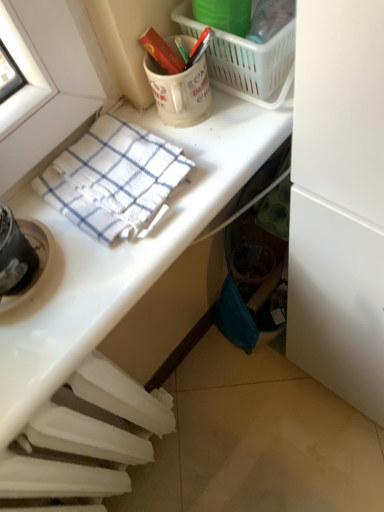
Question: Can you confirm if white checkered towel at upper left is shorter than white glossy towel at upper left?

Choices:
 (A) no
 (B) yes

Answer: (B)

Question: Is there a large distance between white checkered towel at upper left and white glossy towel at upper left?

Choices:
 (A) no
 (B) yes

Answer: (A)

Question: Is white glossy towel at upper left at the back of white checkered towel at upper left?

Choices:
 (A) yes
 (B) no

Answer: (B)

Question: Is white checkered towel at upper left placed right next to white glossy towel at upper left?

Choices:
 (A) no
 (B) yes

Answer: (A)

Question: Is white checkered towel at upper left positioned behind white glossy towel at upper left?

Choices:
 (A) yes
 (B) no

Answer: (A)

Question: Is white checkered towel at upper left facing towards white glossy towel at upper left?

Choices:
 (A) no
 (B) yes

Answer: (A)

Question: Is white glossy towel at upper left bigger than white plastic radiator at lower left?

Choices:
 (A) yes
 (B) no

Answer: (B)

Question: Is white glossy towel at upper left aimed at white plastic radiator at lower left?

Choices:
 (A) no
 (B) yes

Answer: (A)

Question: Is white glossy towel at upper left turned away from white plastic radiator at lower left?

Choices:
 (A) yes
 (B) no

Answer: (B)

Question: Does white glossy towel at upper left have a greater width compared to white plastic radiator at lower left?

Choices:
 (A) no
 (B) yes

Answer: (B)

Question: Is white glossy towel at upper left next to white plastic radiator at lower left?

Choices:
 (A) yes
 (B) no

Answer: (A)

Question: From the image's perspective, does white glossy towel at upper left appear lower than white plastic radiator at lower left?

Choices:
 (A) yes
 (B) no

Answer: (B)

Question: From a real-world perspective, does white checkered towel at upper left stand above white matte coffee cup at upper center?

Choices:
 (A) yes
 (B) no

Answer: (B)